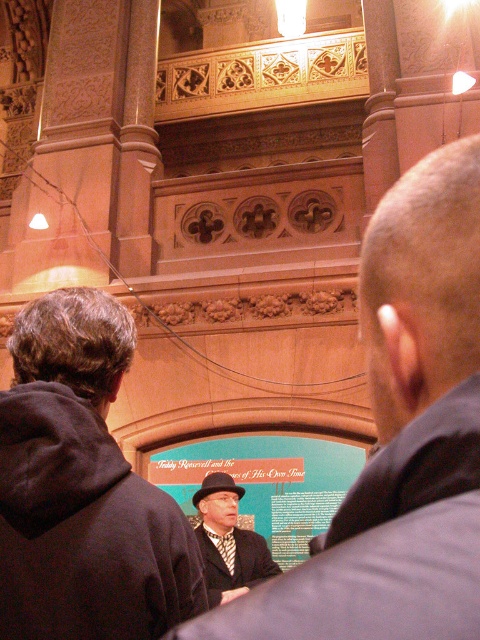
Question: Is black hat at center wider than matte black hat at center?

Choices:
 (A) yes
 (B) no

Answer: (A)

Question: Can you confirm if black hat at center is positioned above teal matte signboard at center?

Choices:
 (A) no
 (B) yes

Answer: (B)

Question: Among these objects, which one is nearest to the camera?

Choices:
 (A) dark gray hoodie at center
 (B) teal matte signboard at center
 (C) black hat at center

Answer: (C)

Question: Which point is farther to the camera?

Choices:
 (A) dark gray hoodie at center
 (B) teal matte signboard at center

Answer: (B)

Question: Which of the following is the closest to the observer?

Choices:
 (A) dark gray hoodie at center
 (B) teal matte signboard at center
 (C) matte black hat at center
 (D) black hat at center

Answer: (D)

Question: Can you confirm if dark gray hoodie at center is positioned above matte black hat at center?

Choices:
 (A) yes
 (B) no

Answer: (A)